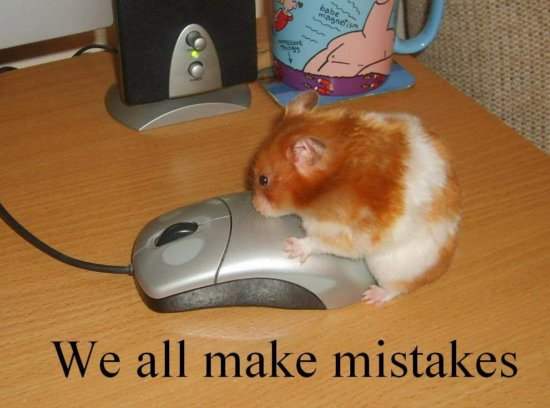
Where is `green light`? The image size is (550, 408). green light is located at coordinates (196, 55).